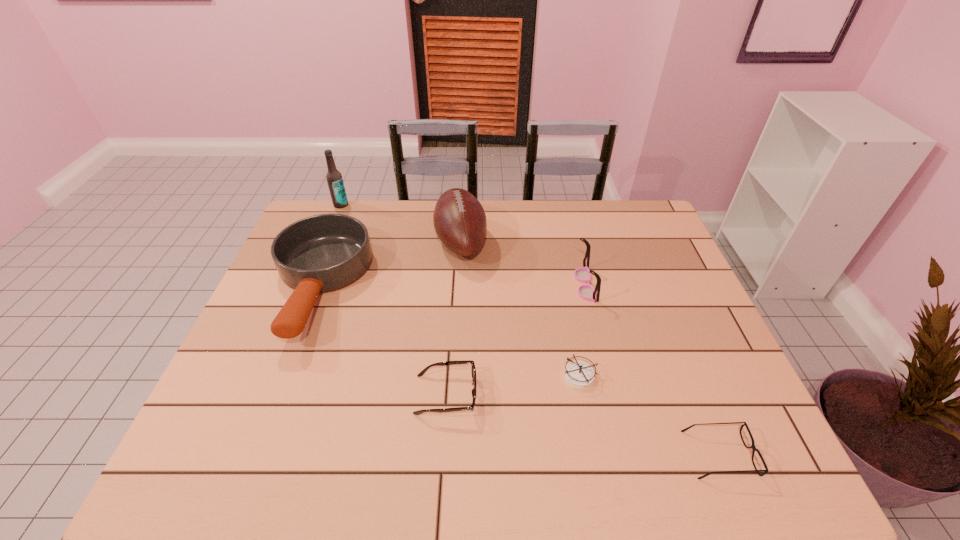
You are a GUI agent. You are given a task and a screenshot of the screen. Output one action in this format:
    pyautogui.click(x=<x>, y=<y>)
    Task: Click on the vacant region that satisfies the following two spatial constraints: 1. on the label of the compass; 2. on the left side of the beer bottle
    The height and width of the screenshot is (540, 960).
    Given the screenshot: What is the action you would take?
    pyautogui.click(x=271, y=376)

Identify the location of free spot that satisfies the following two spatial constraints: 1. on the front side of the compass; 2. on the lenses of the leftmost spectacles. Image resolution: width=960 pixels, height=540 pixels. (583, 394).

Where is `free space in the image that satisfies the following two spatial constraints: 1. on the label of the tallest object; 2. on the left side of the football (American)`? free space in the image that satisfies the following two spatial constraints: 1. on the label of the tallest object; 2. on the left side of the football (American) is located at coordinates (325, 241).

At what (x,y) coordinates should I click in order to perform the action: click on free space that satisfies the following two spatial constraints: 1. on the label of the football (American); 2. on the right side of the beer bottle. Please return your answer as a coordinate pair (x, y). This screenshot has width=960, height=540. Looking at the image, I should click on (325, 241).